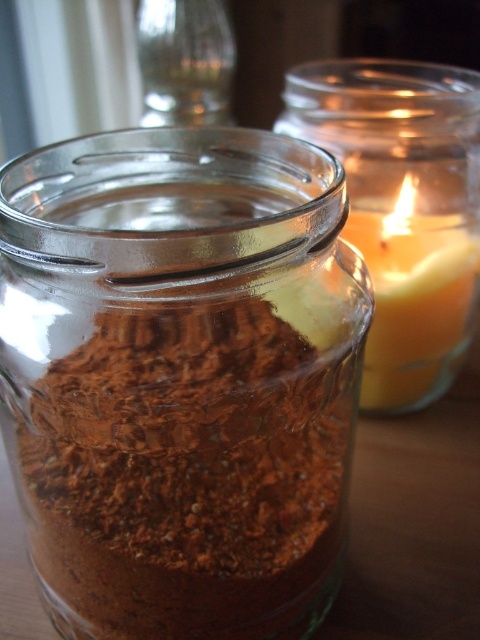
Who is positioned more to the left, transparent glass jar at center or transparent glass jar at upper center?

transparent glass jar at upper center

Does point (312, 524) come closer to viewer compared to point (215, 51)?

Yes.

Identify the location of transparent glass jar at center. (180, 378).

Is transparent glass jar at center to the right of yellow wax candle at right from the viewer's perspective?

In fact, transparent glass jar at center is to the left of yellow wax candle at right.

Which is more to the right, transparent glass jar at center or yellow wax candle at right?

From the viewer's perspective, yellow wax candle at right appears more on the right side.

Who is more forward, (193,548) or (384,301)?

Point (193,548) is more forward.

This screenshot has width=480, height=640. I want to click on transparent glass jar at center, so click(180, 378).

Which is more to the right, yellow wax candle at right or transparent glass jar at upper center?

yellow wax candle at right is more to the right.

Who is shorter, yellow wax candle at right or transparent glass jar at upper center?

With less height is yellow wax candle at right.

Between point (367, 392) and point (144, 93), which one is positioned in front?

Point (367, 392) is more forward.

At what (x,y) coordinates should I click in order to perform the action: click on yellow wax candle at right. Please return your answer as a coordinate pair (x, y). This screenshot has width=480, height=640. Looking at the image, I should click on (415, 305).